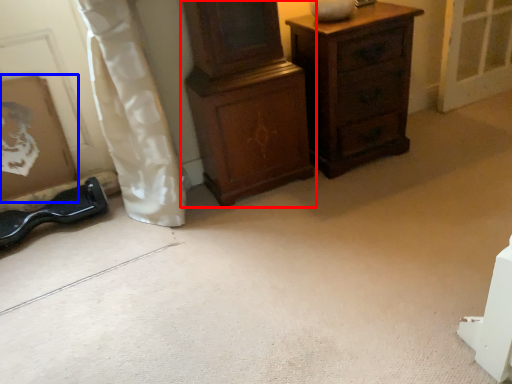
Question: Which object appears farthest to the camera in this image, chest of drawers (highlighted by a red box) or picture frame (highlighted by a blue box)?

Choices:
 (A) chest of drawers
 (B) picture frame

Answer: (B)